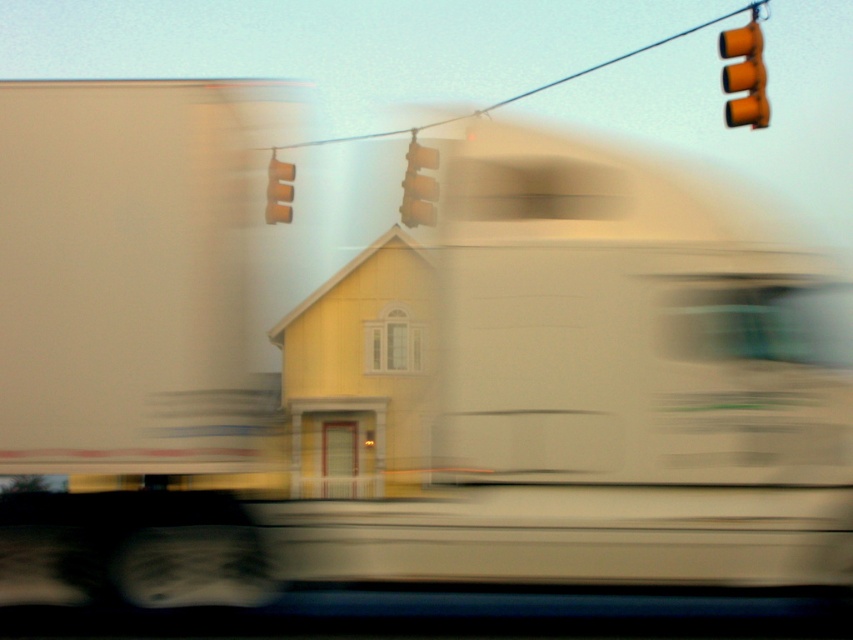
Question: In this image, where is yellow matte traffic light at upper right located relative to yellow matte traffic light at center?

Choices:
 (A) left
 (B) right

Answer: (B)

Question: Estimate the real-world distances between objects in this image. Which object is closer to the yellow matte traffic light at upper right?

Choices:
 (A) orange matte traffic light at upper center
 (B) yellow matte traffic light at center

Answer: (B)

Question: Which of these objects is positioned farthest from the orange matte traffic light at upper center?

Choices:
 (A) yellow matte traffic light at upper right
 (B) yellow matte traffic light at center

Answer: (A)

Question: Can you confirm if yellow matte traffic light at upper right is positioned to the left of yellow matte traffic light at center?

Choices:
 (A) no
 (B) yes

Answer: (A)

Question: Does yellow matte traffic light at upper right appear under yellow matte traffic light at center?

Choices:
 (A) yes
 (B) no

Answer: (B)

Question: Which object is the farthest from the orange matte traffic light at upper center?

Choices:
 (A) yellow matte traffic light at center
 (B) yellow matte traffic light at upper right

Answer: (B)